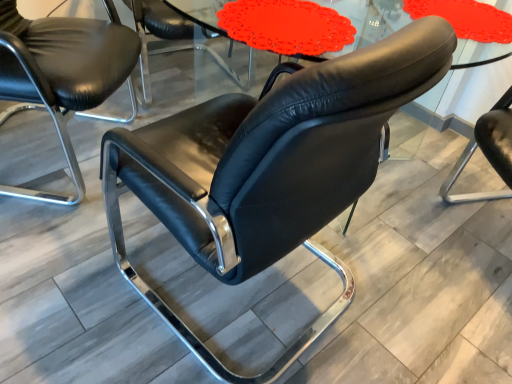
Question: Is black leather chair at left, arranged as the second chair when viewed from the front, at the right side of matte glass table at center?

Choices:
 (A) no
 (B) yes

Answer: (A)

Question: Is black leather chair at left, arranged as the second chair when viewed from the front, at the left side of matte glass table at center?

Choices:
 (A) no
 (B) yes

Answer: (B)

Question: Does black leather chair at left, arranged as the second chair when viewed from the back, come in front of matte glass table at center?

Choices:
 (A) yes
 (B) no

Answer: (B)

Question: Does black leather chair at left, arranged as the second chair when viewed from the front, have a lesser width compared to matte glass table at center?

Choices:
 (A) no
 (B) yes

Answer: (A)

Question: Can you confirm if black leather chair at left, arranged as the second chair when viewed from the front, is shorter than matte glass table at center?

Choices:
 (A) no
 (B) yes

Answer: (A)

Question: Is matte glass table at center wider or thinner than black leather chair at left, arranged as the second chair when viewed from the back?

Choices:
 (A) thin
 (B) wide

Answer: (A)

Question: Considering the positions of point (354, 29) and point (119, 44), is point (354, 29) closer or farther from the camera than point (119, 44)?

Choices:
 (A) farther
 (B) closer

Answer: (B)

Question: Considering the positions of matte glass table at center and black leather chair at left, arranged as the second chair when viewed from the front, in the image, is matte glass table at center taller or shorter than black leather chair at left, arranged as the second chair when viewed from the front,?

Choices:
 (A) tall
 (B) short

Answer: (B)

Question: From the image's perspective, is matte glass table at center located above or below black leather chair at left, arranged as the second chair when viewed from the front?

Choices:
 (A) below
 (B) above

Answer: (B)

Question: Is black leather chair at left, arranged as the second chair when viewed from the front, in front of or behind matte glass table at center in the image?

Choices:
 (A) behind
 (B) front

Answer: (A)

Question: Considering the relative positions of black leather chair at left, arranged as the second chair when viewed from the back, and matte glass table at center in the image provided, is black leather chair at left, arranged as the second chair when viewed from the back, to the left or to the right of matte glass table at center?

Choices:
 (A) left
 (B) right

Answer: (A)

Question: Considering the positions of black leather chair at left, arranged as the second chair when viewed from the front, and matte glass table at center in the image, is black leather chair at left, arranged as the second chair when viewed from the front, taller or shorter than matte glass table at center?

Choices:
 (A) short
 (B) tall

Answer: (B)

Question: Is black leather chair at left, arranged as the second chair when viewed from the back, inside or outside of matte glass table at center?

Choices:
 (A) outside
 (B) inside

Answer: (A)

Question: From the image's perspective, is black leather chair at center, the 1th chair viewed from the front, located above or below black leather chair at left, arranged as the second chair when viewed from the front?

Choices:
 (A) below
 (B) above

Answer: (A)

Question: Considering the positions of point (358, 110) and point (22, 195), is point (358, 110) closer or farther from the camera than point (22, 195)?

Choices:
 (A) closer
 (B) farther

Answer: (A)